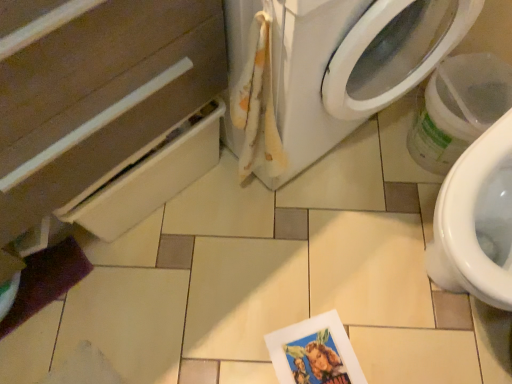
The height and width of the screenshot is (384, 512). I want to click on vacant point to the right of printed paper postcard at lower center, so click(408, 339).